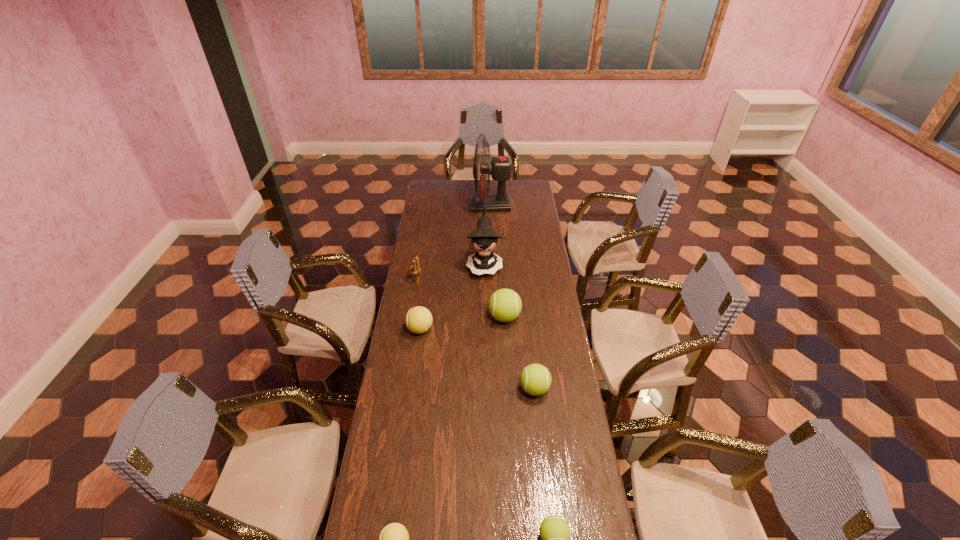
Where is `object that is at the right edge`? Image resolution: width=960 pixels, height=540 pixels. object that is at the right edge is located at coordinates (535, 379).

In order to click on vacant position at the far edge of the desktop in this screenshot , I will do [x=459, y=180].

You are a GUI agent. You are given a task and a screenshot of the screen. Output one action in this format:
    pyautogui.click(x=<x>, y=<y>)
    Task: Click on the free space at the left edge of the desktop
    Image resolution: width=960 pixels, height=540 pixels.
    Given the screenshot: What is the action you would take?
    pyautogui.click(x=422, y=279)

In the image, there is a desktop. Where is `vacant region at the right edge`? This screenshot has height=540, width=960. vacant region at the right edge is located at coordinates (535, 244).

This screenshot has width=960, height=540. Find the location of `vacant space at the far right corner of the desktop`. vacant space at the far right corner of the desktop is located at coordinates (534, 181).

Locate an element on the screen. unoccupied area between the candle holder and the second tallest object is located at coordinates (451, 273).

Image resolution: width=960 pixels, height=540 pixels. Find the location of `vacant area between the tallest tennis ball and the second farthest green tennis ball`. vacant area between the tallest tennis ball and the second farthest green tennis ball is located at coordinates (519, 353).

The height and width of the screenshot is (540, 960). Find the location of `object that is the fourth closest to the second farthest green tennis ball`. object that is the fourth closest to the second farthest green tennis ball is located at coordinates (484, 238).

Select which object is the sixth closest to the doll. Please provide its 2D coordinates. Your answer should be formatted as a tuple, i.e. [(x, y)], where the tuple contains the x and y coordinates of a point satisfying the conditions above.

[(554, 531)]

The height and width of the screenshot is (540, 960). In order to click on tennis ball identified as the second closest to the seventh shortest object in this screenshot , I will do `click(418, 320)`.